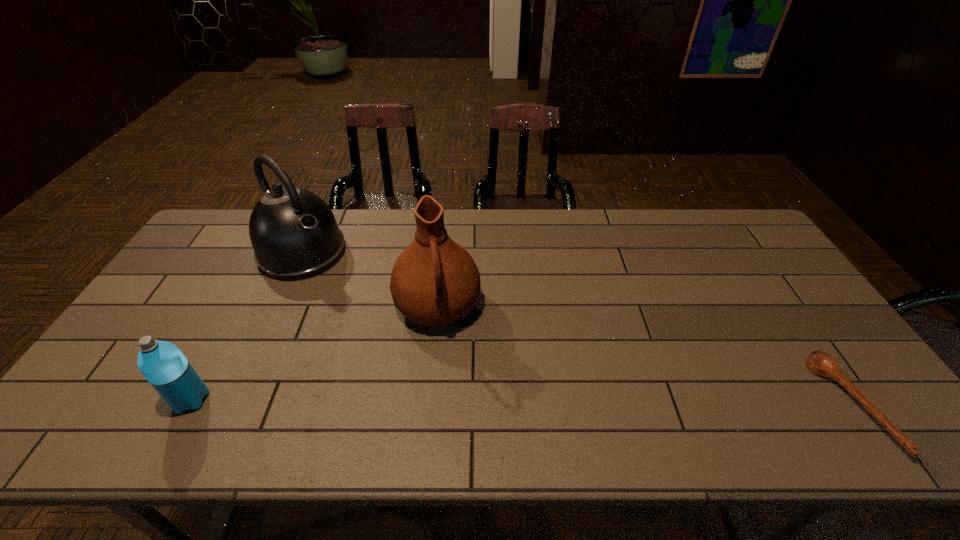
Locate an element on the screen. Image resolution: width=960 pixels, height=540 pixels. the second shortest object is located at coordinates (165, 367).

Locate an element on the screen. The width and height of the screenshot is (960, 540). wooden spoon is located at coordinates (819, 363).

Identify the location of the shortest object. This screenshot has height=540, width=960. (819, 363).

Locate an element on the screen. pitcher is located at coordinates (434, 282).

Identify the location of kettle. The height and width of the screenshot is (540, 960). (294, 234).

The width and height of the screenshot is (960, 540). In order to click on free location located 0.340m on the back of the second shortest object in this screenshot , I will do `click(252, 288)`.

The width and height of the screenshot is (960, 540). I want to click on vacant space located 0.250m on the back of the shortest object, so click(771, 289).

This screenshot has height=540, width=960. Identify the location of blank space located on the side of the second object from right to left with the handle. 449,383.

You are a GUI agent. You are given a task and a screenshot of the screen. Output one action in this format:
    pyautogui.click(x=<x>, y=<y>)
    Task: Click on the vacant space located 0.170m on the side of the second object from right to left with the handle
    This screenshot has width=960, height=540.
    Given the screenshot: What is the action you would take?
    pyautogui.click(x=451, y=398)

The height and width of the screenshot is (540, 960). Find the location of `vacant space situated 0.230m on the spout of the kettle`. vacant space situated 0.230m on the spout of the kettle is located at coordinates (370, 311).